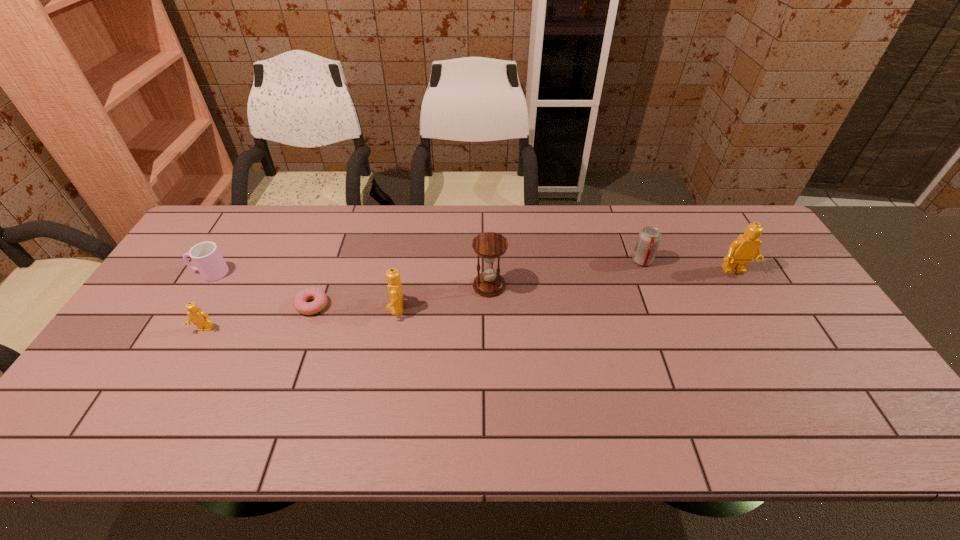
I want to click on soda can, so click(649, 238).

Locate an element on the screen. This screenshot has width=960, height=540. the second object from right to left is located at coordinates (649, 238).

Identify the location of free space located 0.170m on the face of the nearest Lego. This screenshot has width=960, height=540. (171, 391).

Where is `blank area located on the face of the fourth object from left to right`? The image size is (960, 540). blank area located on the face of the fourth object from left to right is located at coordinates (331, 308).

This screenshot has height=540, width=960. In order to click on vacant space located 0.240m on the face of the fourth object from left to right in this screenshot , I will do `click(302, 308)`.

The width and height of the screenshot is (960, 540). In order to click on free space located 0.230m on the face of the fourth object from left to right in this screenshot , I will do `click(306, 308)`.

Identify the location of free space located 0.300m on the face of the rightmost object. The height and width of the screenshot is (540, 960). (787, 362).

The height and width of the screenshot is (540, 960). I want to click on vacant space positioned on the right of the doughnut, so click(410, 305).

Find the location of a particular element. vacant space located 0.060m with the handle on the side of the cup is located at coordinates (173, 273).

In order to click on vacant region located 0.190m on the back of the fifth object from left to right in this screenshot , I will do pos(489,234).